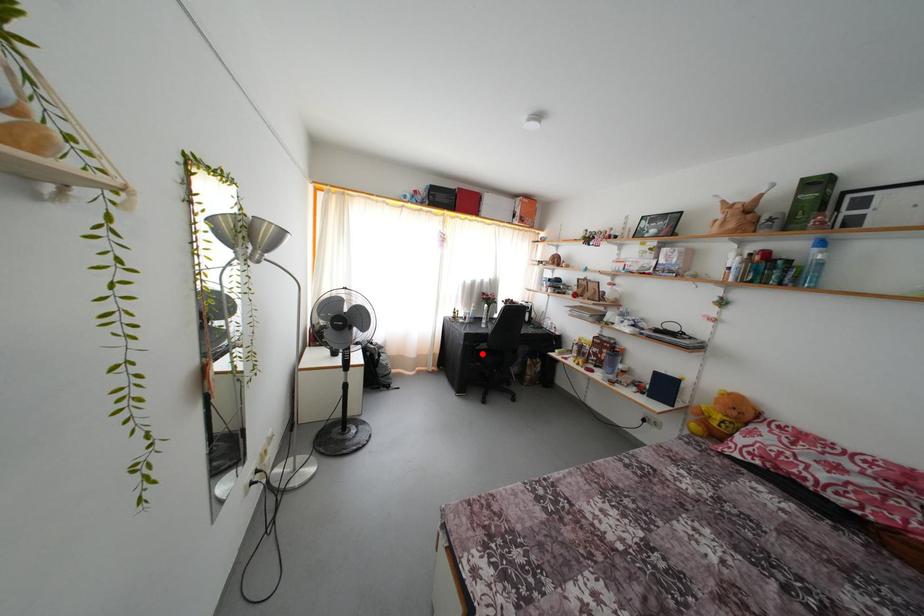
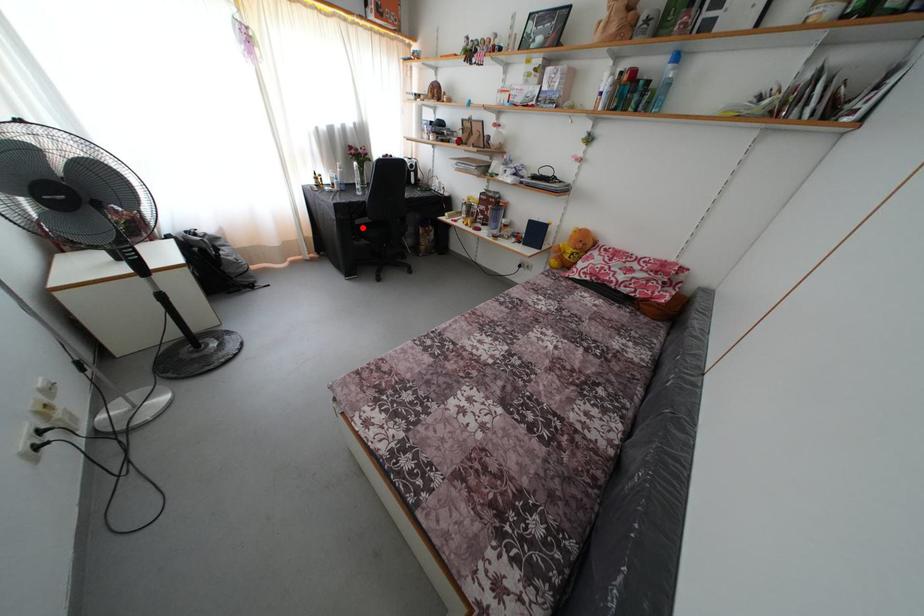
I am providing you with two images of the same scene from different viewpoints. A red point is marked on the first image and another point is marked on the second image. Is the red point in image1 aligned with the point shown in image2?

Yes